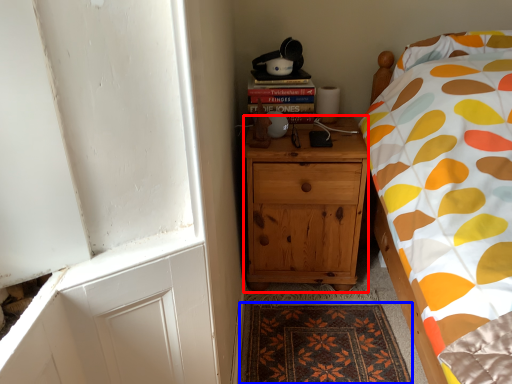
Question: Which point is further to the camera, cabinetry (highlighted by a red box) or mat (highlighted by a blue box)?

Choices:
 (A) cabinetry
 (B) mat

Answer: (A)